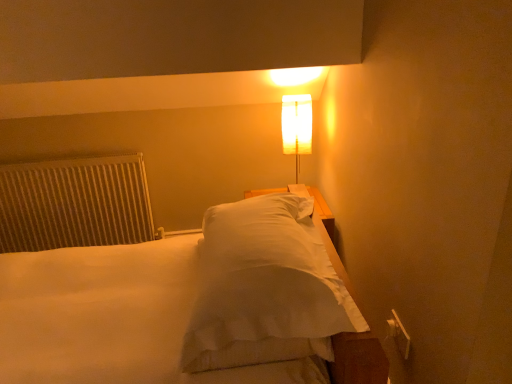
You are a GUI agent. You are given a task and a screenshot of the screen. Output one action in this format:
    pyautogui.click(x=<x>, y=<y>)
    Task: Click on the white fabric lamp at upper center
    Image resolution: width=512 pixels, height=384 pixels.
    Given the screenshot: What is the action you would take?
    pyautogui.click(x=297, y=126)

This screenshot has width=512, height=384. What do you see at coordinates (74, 203) in the screenshot?
I see `white textured radiator at left` at bounding box center [74, 203].

Locate an element on the screen. Image resolution: width=512 pixels, height=384 pixels. white fabric lamp at upper center is located at coordinates (297, 126).

Is white fabric lamp at upper center bigger than white textured radiator at left?

No, white fabric lamp at upper center is not bigger than white textured radiator at left.

Is white textured radiator at left located within white fabric lamp at upper center?

No.

Is white fabric lamp at upper center far away from white textured radiator at left?

white fabric lamp at upper center is positioned a significant distance from white textured radiator at left.

Considering the relative sizes of white fabric lamp at upper center and white textured radiator at left in the image provided, is white fabric lamp at upper center thinner than white textured radiator at left?

No, white fabric lamp at upper center is not thinner than white textured radiator at left.

Who is smaller, white soft bed at center or white fabric lamp at upper center?

white fabric lamp at upper center.

This screenshot has height=384, width=512. I want to click on lamp that appears behind the white soft bed at center, so click(x=297, y=126).

Is white soft bed at center positioned with its back to white fabric lamp at upper center?

No, white soft bed at center is not facing the opposite direction of white fabric lamp at upper center.

Is point (161, 362) less distant than point (305, 130)?

Yes, it is.

From a real-world perspective, which is physically above, white soft bed at center or white textured radiator at left?

In real-world perspective, white soft bed at center is above.

Does point (154, 363) appear closer or farther from the camera than point (32, 213)?

Point (154, 363) is positioned closer to the camera compared to point (32, 213).

From the image's perspective, which is below, white soft bed at center or white textured radiator at left?

white soft bed at center.

Does white soft bed at center lie behind white textured radiator at left?

No, white soft bed at center is closer to the camera.

Does white fabric lamp at upper center contain white soft bed at center?

No, white soft bed at center is not surrounded by white fabric lamp at upper center.

Is white fabric lamp at upper center further to the viewer compared to white soft bed at center?

Yes, white fabric lamp at upper center is behind white soft bed at center.

From the image's perspective, would you say white fabric lamp at upper center is shown under white soft bed at center?

No, from the image's perspective, white fabric lamp at upper center is not below white soft bed at center.

Is white fabric lamp at upper center facing away from white soft bed at center?

No, white fabric lamp at upper center's orientation is not away from white soft bed at center.

Is white textured radiator at left completely or partially outside of white fabric lamp at upper center?

That's correct, white textured radiator at left is outside of white fabric lamp at upper center.

From the picture: Is white textured radiator at left positioned with its back to white fabric lamp at upper center?

white textured radiator at left is not turned away from white fabric lamp at upper center.

This screenshot has height=384, width=512. In order to click on lamp above the white textured radiator at left (from the image's perspective) in this screenshot , I will do (297, 126).

Does white textured radiator at left have a lesser width compared to white fabric lamp at upper center?

Yes.

Is the surface of white textured radiator at left in direct contact with white soft bed at center?

No, white textured radiator at left is not making contact with white soft bed at center.

From the image's perspective, between white textured radiator at left and white soft bed at center, who is located below?

From the image's view, white soft bed at center is below.

Considering the relative sizes of white textured radiator at left and white soft bed at center in the image provided, is white textured radiator at left wider than white soft bed at center?

No.

How different are the orientations of white textured radiator at left and white soft bed at center in degrees?

They differ by 105 degrees in their facing directions.

Find the location of `radiator below the white fabric lamp at upper center (from the image's perspective)`. radiator below the white fabric lamp at upper center (from the image's perspective) is located at coordinates (74, 203).

Image resolution: width=512 pixels, height=384 pixels. Identify the location of lamp above the white soft bed at center (from a real-world perspective). point(297,126).

Estimate the real-world distances between objects in this image. Which object is further from white fabric lamp at upper center, white soft bed at center or white textured radiator at left?

Among the two, white textured radiator at left is located further to white fabric lamp at upper center.

Based on their spatial positions, is white fabric lamp at upper center or white textured radiator at left further from white soft bed at center?

Among the two, white fabric lamp at upper center is located further to white soft bed at center.

Based on their spatial positions, is white textured radiator at left or white soft bed at center closer to white fabric lamp at upper center?

Among the two, white soft bed at center is located nearer to white fabric lamp at upper center.

Looking at the image, which one is located closer to white textured radiator at left, white fabric lamp at upper center or white soft bed at center?

Based on the image, white soft bed at center appears to be nearer to white textured radiator at left.

From the image, which object appears to be nearer to white soft bed at center, white textured radiator at left or white fabric lamp at upper center?

white textured radiator at left is positioned closer to the anchor white soft bed at center.

When comparing their distances from white textured radiator at left, does white soft bed at center or white fabric lamp at upper center seem further?

Based on the image, white fabric lamp at upper center appears to be further to white textured radiator at left.

At what (x,y) coordinates should I click in order to perform the action: click on lamp positioned between white soft bed at center and white textured radiator at left from near to far. Please return your answer as a coordinate pair (x, y). Image resolution: width=512 pixels, height=384 pixels. Looking at the image, I should click on (297, 126).